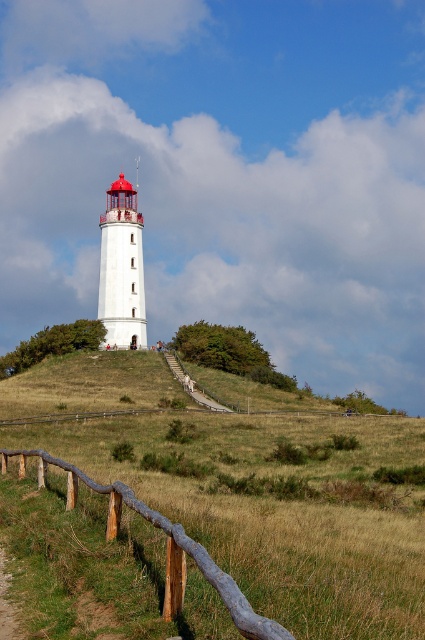
You are standing at point [25,385] and want to reach the lighthouse. The path is 78.76 meters long. If you walk at 1.5 meters per second, how many seconds will it take you to reach the lighthouse?

The distance between you and the lighthouse is 78.76 meters. At a walking speed of 1.5 meters per second, dividing the distance by the speed gives 78.76 divided by 1.5, which equals approximately 52.5 seconds. Therefore, it will take about 52.5 seconds to reach the lighthouse.